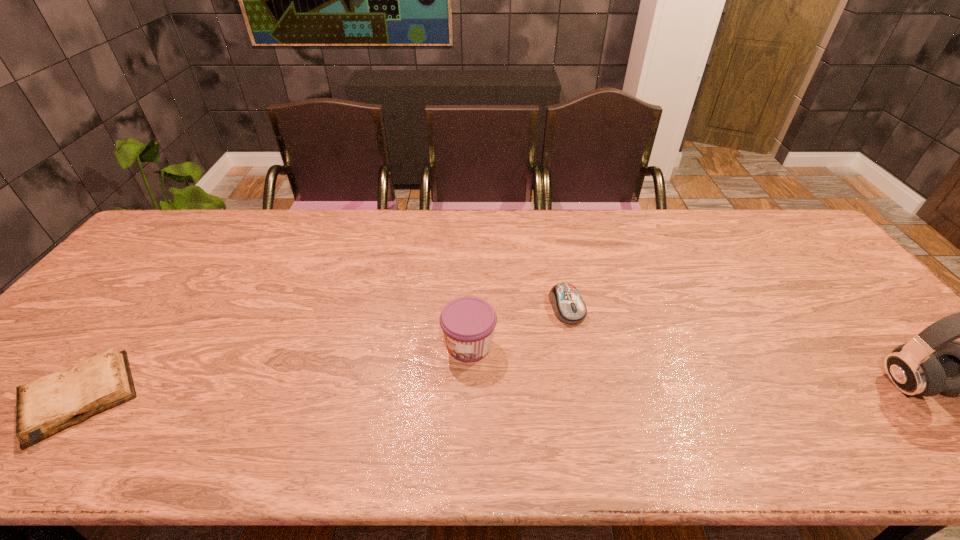
Identify the location of computer mouse. Image resolution: width=960 pixels, height=540 pixels. 568,306.

Find the location of `the second object from right to left`. the second object from right to left is located at coordinates (568, 306).

The height and width of the screenshot is (540, 960). In order to click on jam in this screenshot , I will do `click(468, 323)`.

The image size is (960, 540). Identify the location of the second tallest object. (468, 323).

Find the location of `vacant region located on the wheel side of the third object from left to right`. vacant region located on the wheel side of the third object from left to right is located at coordinates (609, 396).

Locate an element on the screen. This screenshot has height=540, width=960. free space located 0.160m on the wheel side of the third object from left to right is located at coordinates (598, 375).

At what (x,y) coordinates should I click in order to perform the action: click on vacant space located on the wheel side of the third object from left to right. Please return your answer as a coordinate pair (x, y). Looking at the image, I should click on click(597, 371).

This screenshot has width=960, height=540. I want to click on vacant space located on the front label of the jam, so click(x=404, y=383).

In order to click on free spot located on the front label of the jam in this screenshot , I will do `click(404, 383)`.

In order to click on free location located on the front label of the jam in this screenshot , I will do `click(381, 397)`.